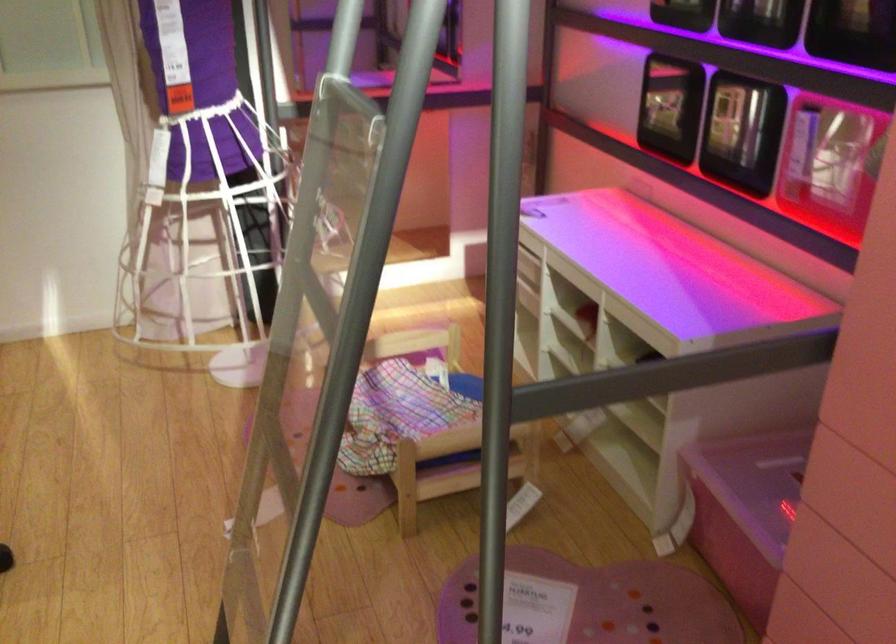
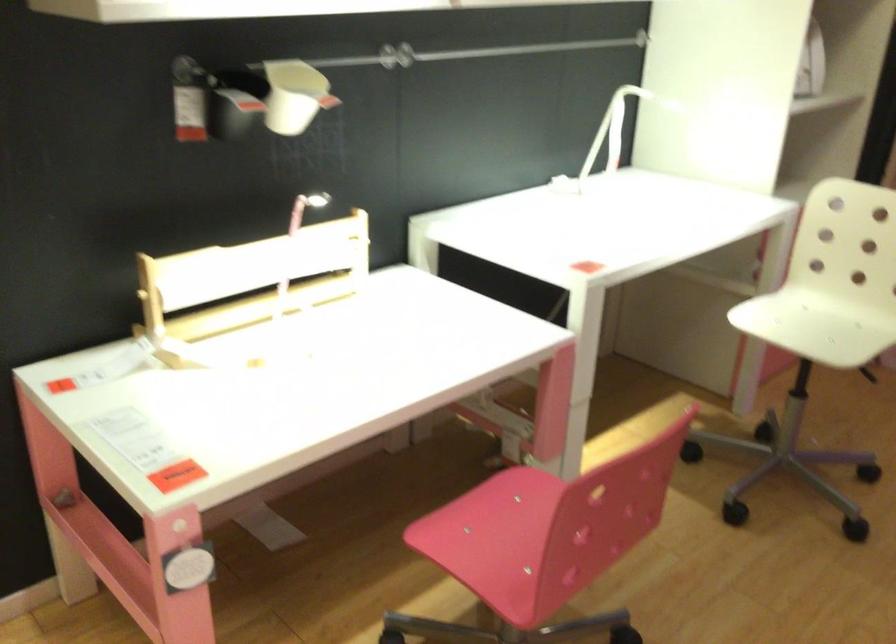
Question: The camera is either moving clockwise (left) or counter-clockwise (right) around the object. The first image is from the beginning of the video and the second image is from the end. Is the camera moving left or right when shooting the video?

Choices:
 (A) Left
 (B) Right

Answer: (B)